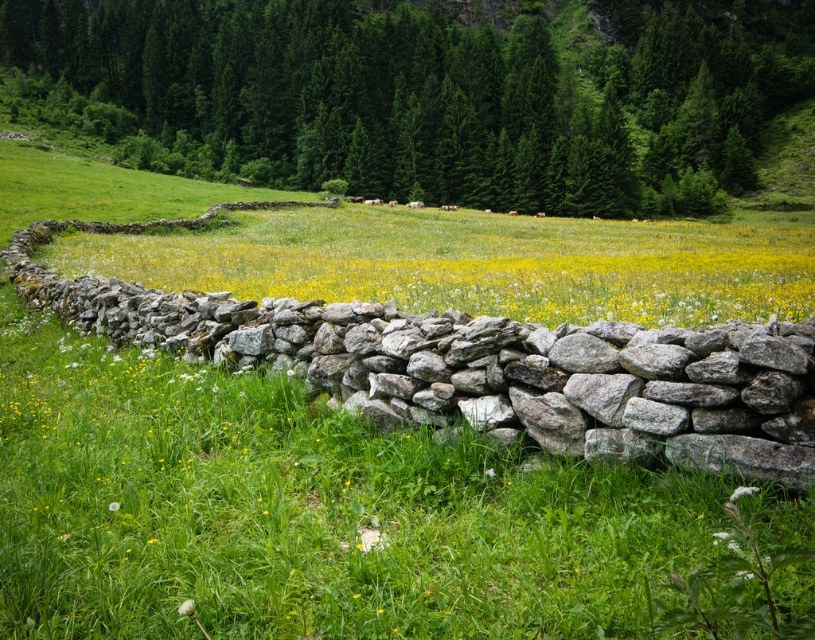
You are standing at the point marked by the coordinates point [476,266]. Looking around, what do you see immediately around you?

You see yellow grass at center immediately around you as the point [476,266] marks yellow grass at center.

You are a gardener who wants to transplant the white fluffy flower at lower right and the white fluffy dandelion at lower left to a new garden bed. Which one requires a larger planting hole in terms of diameter?

The white fluffy flower at lower right requires a larger planting hole because it has a larger size compared to the white fluffy dandelion at lower left.

You are standing in the rural landscape shown in the image. There are two points marked in the scene. One is at coordinate point(747, 492) and the other at point(113, 504). Which of these two points is closer to you?

Point(747, 492) is closer to the camera than point(113, 504), so the point at coordinate point(747, 492) is closer to you.